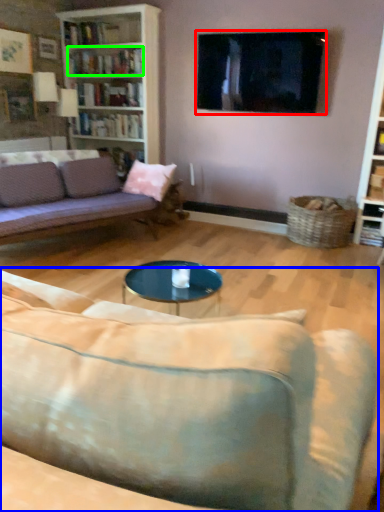
Question: Which object is the closest to the television (highlighted by a red box)? Choose among these: studio couch (highlighted by a blue box) or book (highlighted by a green box).

Choices:
 (A) studio couch
 (B) book

Answer: (B)